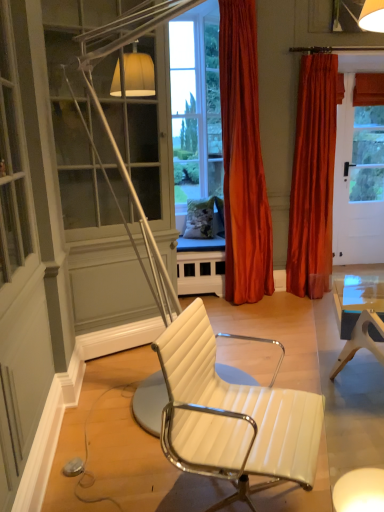
Question: Is white leather chair at center inside the boundaries of velvet orange curtain at right, which ranks as the 2th curtain in left-to-right order, or outside?

Choices:
 (A) inside
 (B) outside

Answer: (B)

Question: From the image's perspective, is white leather chair at center located above or below velvet orange curtain at right, the first curtain when ordered from right to left?

Choices:
 (A) above
 (B) below

Answer: (B)

Question: Estimate the real-world distances between objects in this image. Which object is farther from the white leather chair at center?

Choices:
 (A) velvet orange curtain at right, which ranks as the 2th curtain in left-to-right order
 (B) satin orange curtain at center, arranged as the 2th curtain when viewed from the right

Answer: (A)

Question: Considering the real-world distances, which object is closest to the velvet orange curtain at right, which ranks as the 2th curtain in left-to-right order?

Choices:
 (A) satin orange curtain at center, positioned as the first curtain in left-to-right order
 (B) white leather chair at center

Answer: (A)